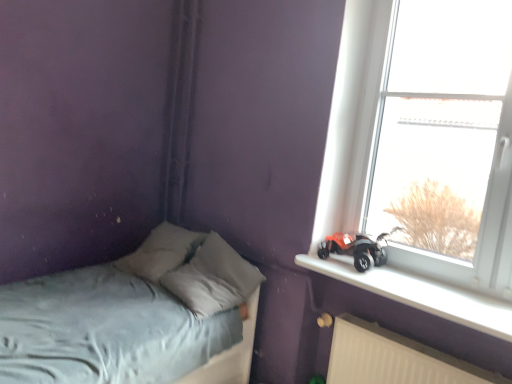
The width and height of the screenshot is (512, 384). I want to click on free point below transparent glass window at upper right (from a real-world perspective), so click(x=453, y=284).